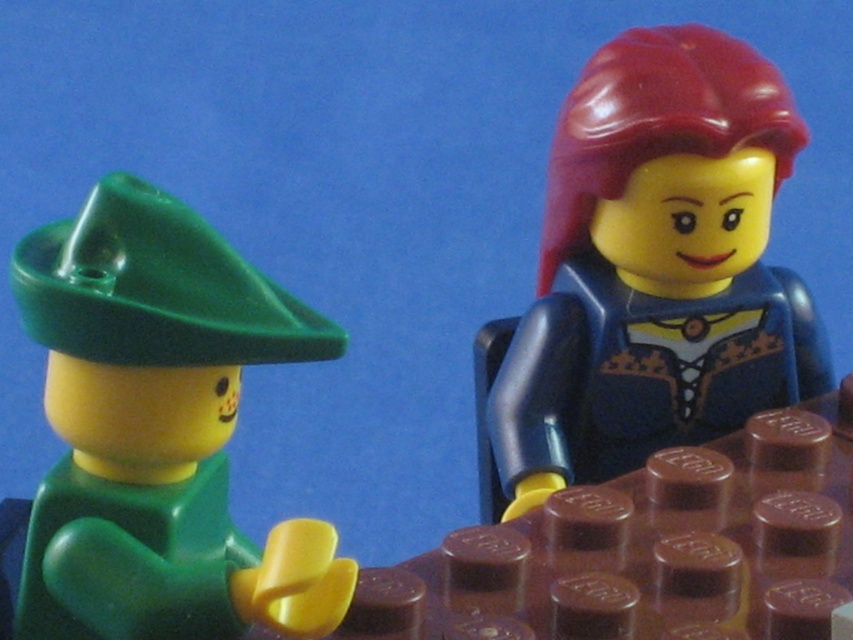
Question: Which of the following is the farthest from the observer?

Choices:
 (A) shiny red hair at upper right
 (B) green matte hat at left

Answer: (A)

Question: Does shiny red hair at upper right have a greater width compared to green matte hat at left?

Choices:
 (A) yes
 (B) no

Answer: (A)

Question: Can you confirm if shiny red hair at upper right is smaller than green matte hat at left?

Choices:
 (A) yes
 (B) no

Answer: (B)

Question: Considering the relative positions of shiny red hair at upper right and green matte hat at left in the image provided, where is shiny red hair at upper right located with respect to green matte hat at left?

Choices:
 (A) below
 (B) above

Answer: (B)